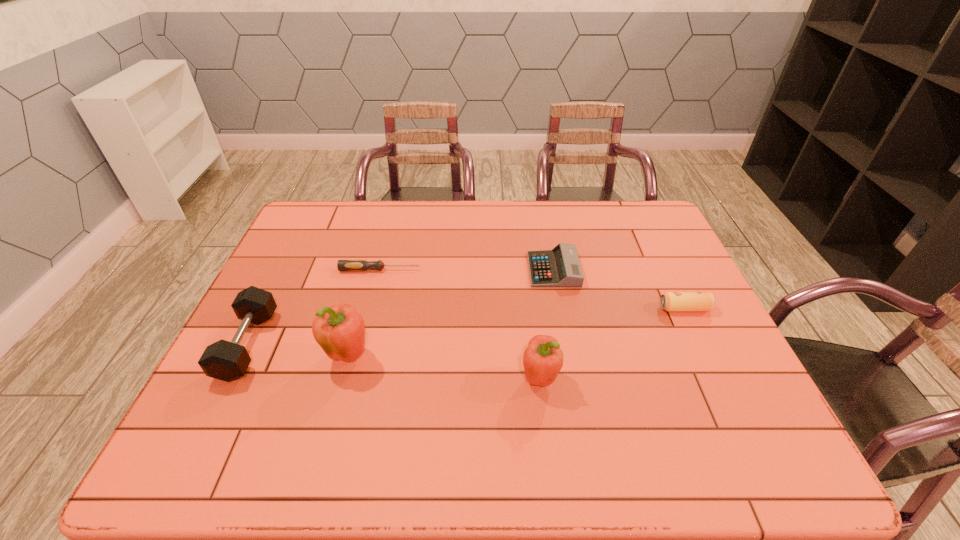
Locate an element on the screen. The image size is (960, 540). vacant space located 0.350m on the back of the tallest object is located at coordinates (377, 253).

Find the location of a particular element. blank space located 0.270m on the right of the right pepper is located at coordinates (672, 379).

Locate an element on the screen. The height and width of the screenshot is (540, 960). vacant area located 0.270m insert the shortest object into a screw head is located at coordinates 509,269.

Locate an element on the screen. This screenshot has height=540, width=960. vacant space located on the left of the fifth tallest object is located at coordinates (426, 270).

Where is `free location located on the right of the leftmost object`? This screenshot has width=960, height=540. free location located on the right of the leftmost object is located at coordinates point(420,345).

Identify the location of free location located 0.290m on the back of the rightmost object. click(651, 239).

This screenshot has width=960, height=540. Find the location of `object positioned at the near edge`. object positioned at the near edge is located at coordinates (543, 359).

At what (x,y) coordinates should I click in order to perform the action: click on object situated at the left edge. Please return your answer as a coordinate pair (x, y). Looking at the image, I should click on (227, 361).

The width and height of the screenshot is (960, 540). Find the location of `object located at the right edge`. object located at the right edge is located at coordinates (670, 301).

This screenshot has width=960, height=540. I want to click on vacant position at the far edge of the desktop, so click(x=572, y=218).